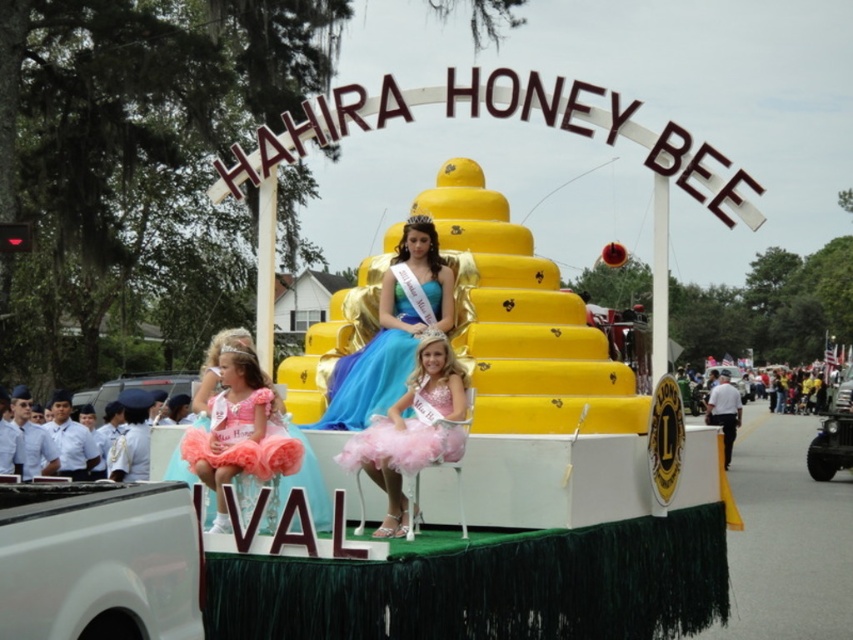
Question: In this image, where is teal satin gown at center located relative to pink tulle dress at lower left?

Choices:
 (A) left
 (B) right

Answer: (B)

Question: Observing the image, what is the correct spatial positioning of pink tulle dress at center in reference to pastel pink tulle dress at center?

Choices:
 (A) left
 (B) right

Answer: (A)

Question: Which object is positioned farthest from the pink tulle dress at lower left?

Choices:
 (A) pink tulle dress at center
 (B) pink tulle tutu at lower left

Answer: (A)

Question: Which object appears farthest from the camera in this image?

Choices:
 (A) pink tulle dress at center
 (B) pastel pink tulle dress at center
 (C) pink tulle tutu at lower left

Answer: (B)

Question: Which point is farther to the camera?

Choices:
 (A) (454, 369)
 (B) (415, 269)

Answer: (B)

Question: In this image, where is teal satin gown at center located relative to pink tulle dress at center?

Choices:
 (A) left
 (B) right

Answer: (A)